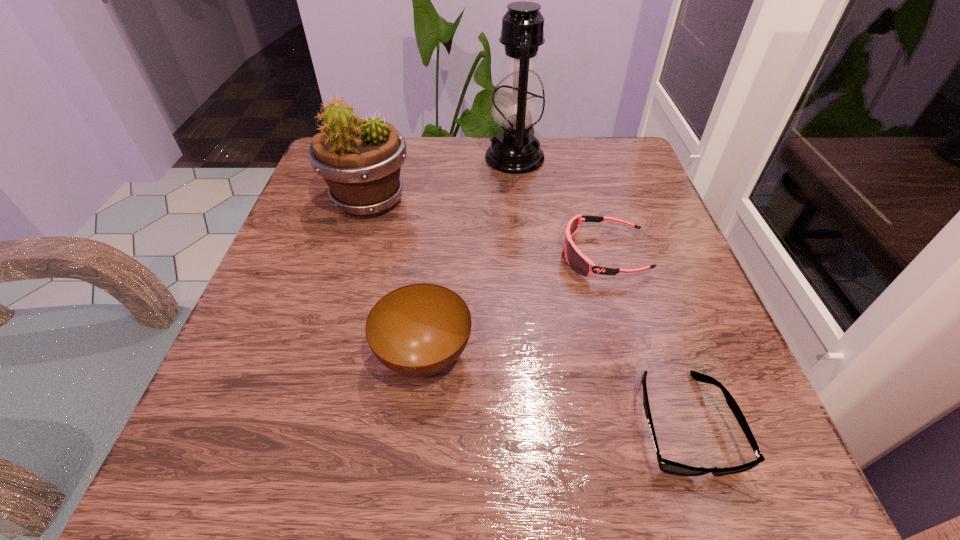
This screenshot has height=540, width=960. What are the coordinates of `vacant region at the far edge of the desktop` in the screenshot? It's located at (474, 192).

Locate an element on the screen. Image resolution: width=960 pixels, height=540 pixels. blank area at the left edge is located at coordinates (291, 335).

You are a GUI agent. You are given a task and a screenshot of the screen. Output one action in this format:
    pyautogui.click(x=<x>, y=<y>)
    Task: Click on the free region at the right edge of the desktop
    
    Given the screenshot: What is the action you would take?
    pyautogui.click(x=687, y=329)

Image resolution: width=960 pixels, height=540 pixels. What are the coordinates of `free space at the near left corner of the desktop` in the screenshot? It's located at (212, 465).

Find the location of a particular element. This screenshot has height=540, width=960. vacant space at the near right corner is located at coordinates (732, 505).

The image size is (960, 540). I want to click on empty space that is in between the tallest object and the shortest object, so click(x=599, y=291).

Locate an element on the screen. This screenshot has width=960, height=540. free space between the flowerpot and the fourth tallest object is located at coordinates (487, 228).

Image resolution: width=960 pixels, height=540 pixels. In order to click on free space between the flowerpot and the shortest object in this screenshot , I will do point(526,312).

Locate an element on the screen. free area in between the third nearest object and the tallest object is located at coordinates (559, 206).

Image resolution: width=960 pixels, height=540 pixels. I want to click on free space between the fourth shortest object and the third farthest object, so click(487, 228).